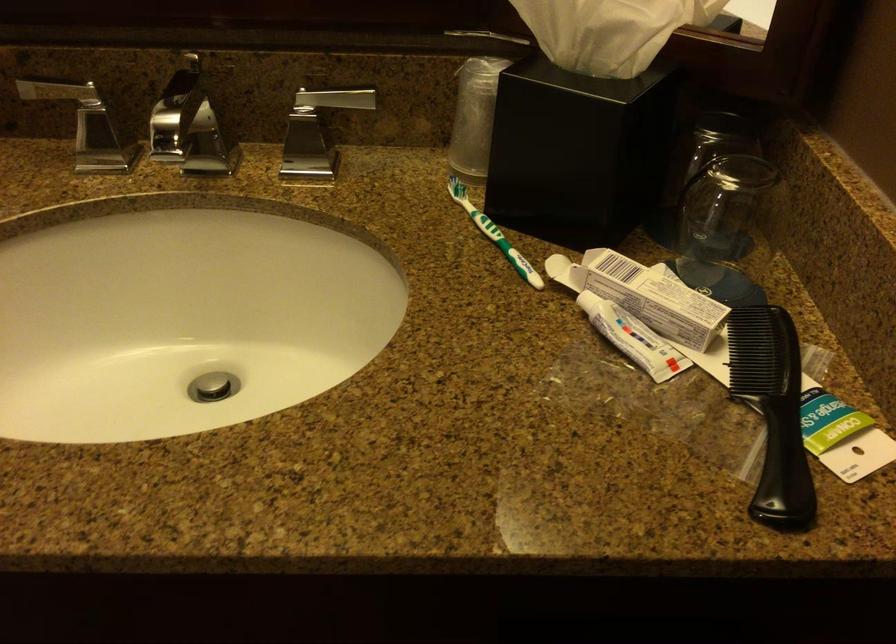
The width and height of the screenshot is (896, 644). I want to click on clear plastic cup, so click(728, 228).